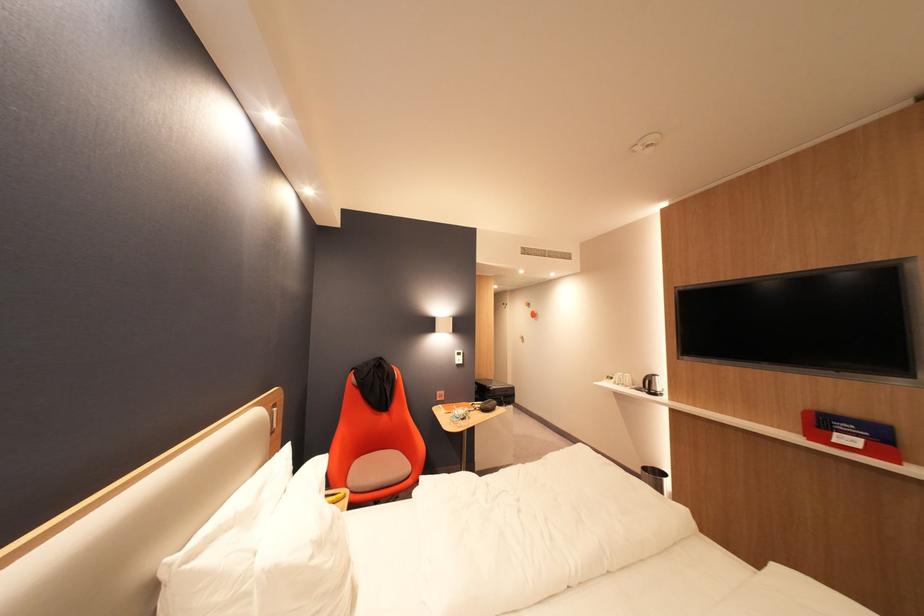
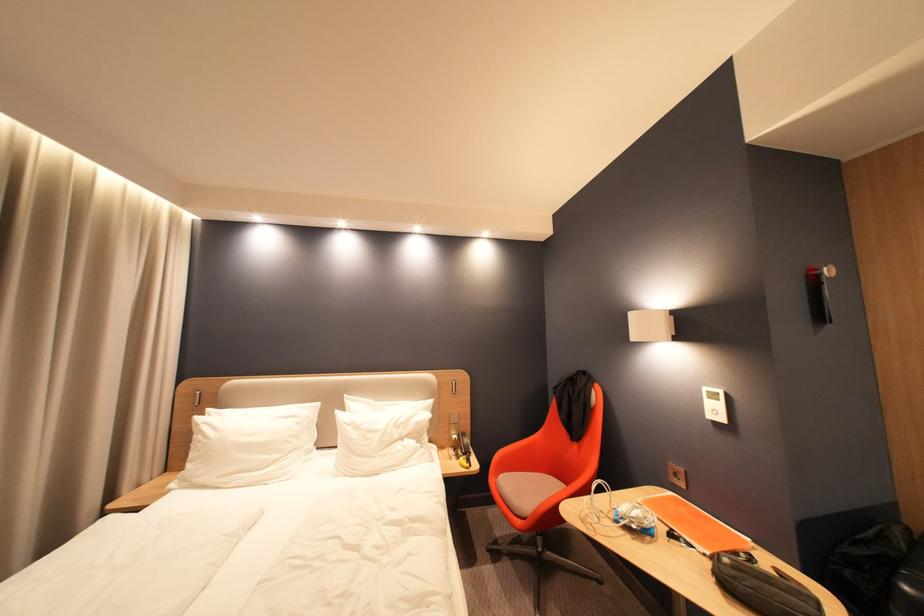
Find the pixel in the second image that matches the point at 299,444 in the first image.

(443, 400)